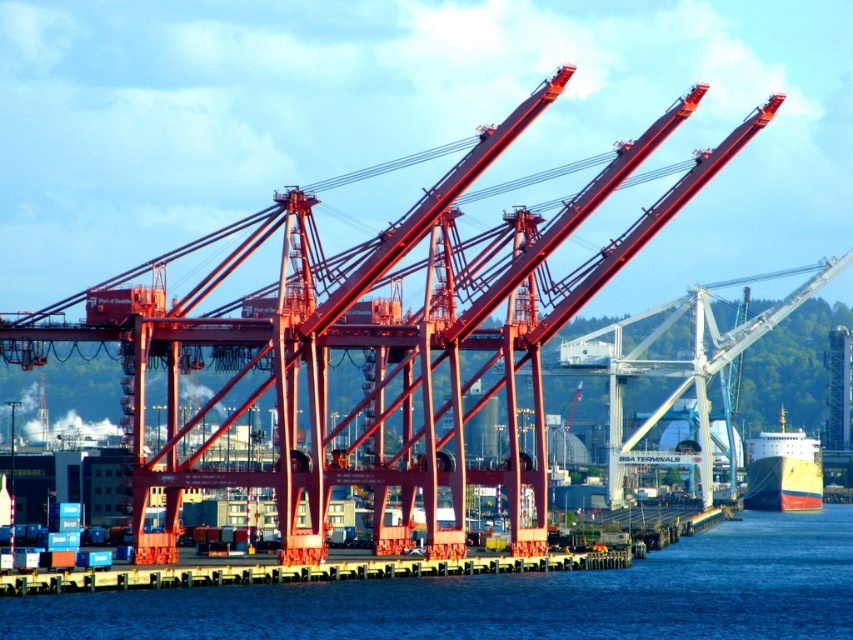
Question: Does blue water at lower center come behind yellow matte ship at lower right?

Choices:
 (A) yes
 (B) no

Answer: (B)

Question: Which of these objects is positioned closest to the yellow matte ship at lower right?

Choices:
 (A) blue water at lower center
 (B) yellow matte dock at lower center

Answer: (A)

Question: Can you confirm if blue water at lower center is positioned to the right of yellow matte ship at lower right?

Choices:
 (A) no
 (B) yes

Answer: (A)

Question: Considering the relative positions of blue water at lower center and yellow matte ship at lower right in the image provided, where is blue water at lower center located with respect to yellow matte ship at lower right?

Choices:
 (A) right
 (B) left

Answer: (B)

Question: Which object is farther from the camera taking this photo?

Choices:
 (A) blue water at lower center
 (B) yellow matte ship at lower right
 (C) yellow matte dock at lower center

Answer: (B)

Question: Based on their relative distances, which object is farther from the yellow matte ship at lower right?

Choices:
 (A) blue water at lower center
 (B) yellow matte dock at lower center

Answer: (B)